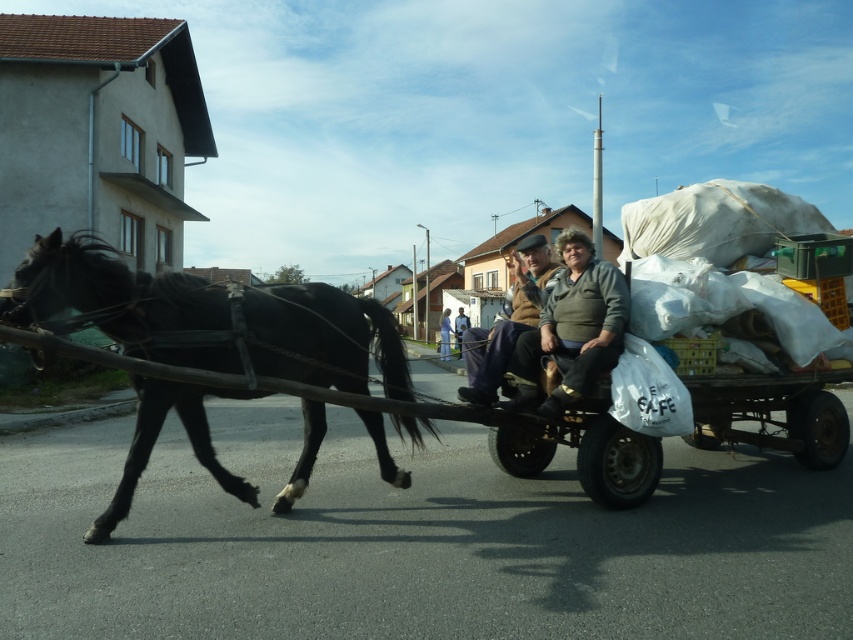
You are standing at the point marked as point (45, 326), which is 5.42 meters away from you. You want to take a photo of the horse and cart. Will you be able to capture the entire horse and cart in your photo if your camera has a 50mm lens?

The point (45, 326) is 5.42 meters away from you. With a 50mm lens, the field of view is approximately 46 degrees. To determine if the entire horse and cart can fit, you need to calculate the angular size of the subject. However, without knowing the actual size of the horse and cart, it is impossible to confirm if they will fit within the 46 degree field of view. Additional information about the dimensions of the horse and cart is required.